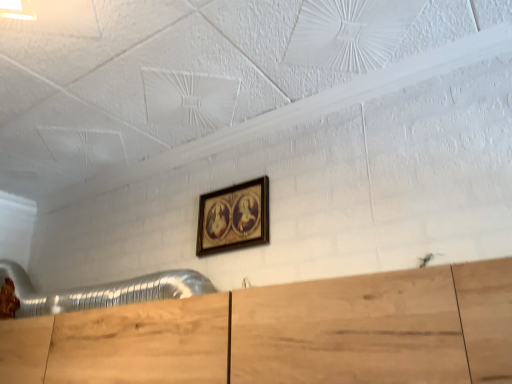
You are a GUI agent. You are given a task and a screenshot of the screen. Output one action in this format:
    pyautogui.click(x=<x>, y=<y>)
    Task: Click on the wooden frame at upper center
    The width and height of the screenshot is (512, 384).
    Given the screenshot: What is the action you would take?
    pyautogui.click(x=234, y=217)

What do you see at coordinates (234, 217) in the screenshot?
I see `wooden frame at upper center` at bounding box center [234, 217].

Find the location of a particular element. This screenshot has height=384, width=512. wooden frame at upper center is located at coordinates (234, 217).